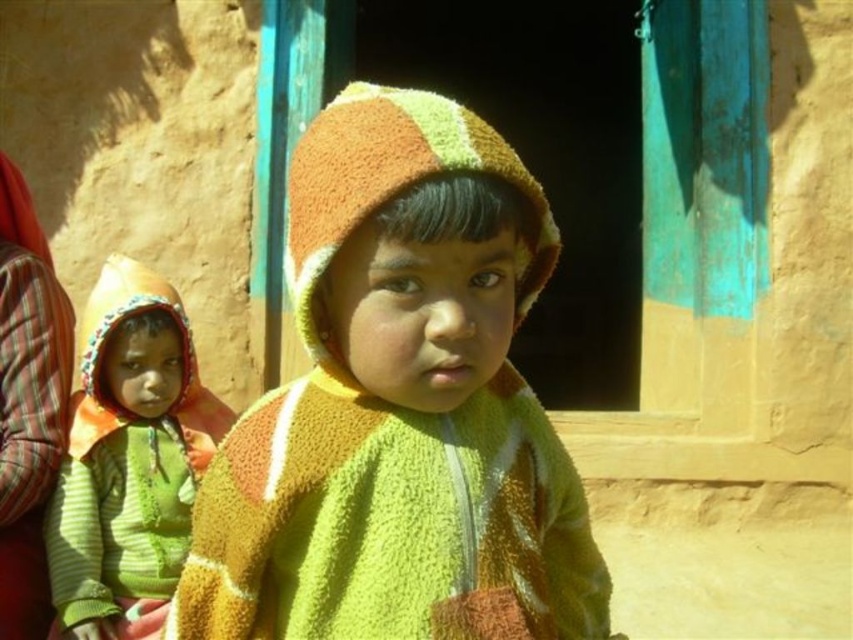
Who is shorter, fluffy fleece jacket at center or green striped sweater at left?

fluffy fleece jacket at center is shorter.

This screenshot has width=853, height=640. What do you see at coordinates (399, 406) in the screenshot?
I see `fluffy fleece jacket at center` at bounding box center [399, 406].

In order to click on fluffy fleece jacket at center in this screenshot , I will do `click(399, 406)`.

What do you see at coordinates (399, 406) in the screenshot? The width and height of the screenshot is (853, 640). I see `fluffy fleece jacket at center` at bounding box center [399, 406].

Does fluffy fleece jacket at center have a lesser width compared to green striped fabric at left?

No.

Which is behind, point (474, 561) or point (22, 408)?

Positioned behind is point (22, 408).

I want to click on fluffy fleece jacket at center, so click(399, 406).

Does green striped sweater at left appear on the right side of green striped fabric at left?

Yes, green striped sweater at left is to the right of green striped fabric at left.

The image size is (853, 640). What do you see at coordinates (129, 452) in the screenshot?
I see `green striped sweater at left` at bounding box center [129, 452].

Where is `green striped sweater at left`? Image resolution: width=853 pixels, height=640 pixels. green striped sweater at left is located at coordinates (129, 452).